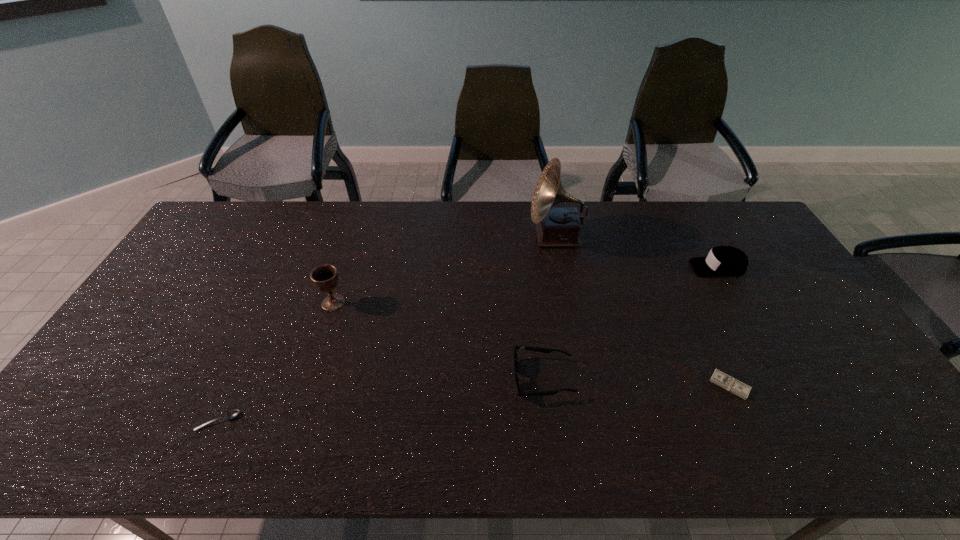
The height and width of the screenshot is (540, 960). Identify the location of the tallest object. (558, 227).

Locate an element on the screen. This screenshot has height=540, width=960. the fifth object from right to left is located at coordinates (325, 277).

The width and height of the screenshot is (960, 540). Identify the location of chalice. 325,277.

Identify the location of the third tallest object. This screenshot has height=540, width=960. (728, 261).

Image resolution: width=960 pixels, height=540 pixels. In order to click on the rightmost object in this screenshot , I will do `click(728, 261)`.

You are a GUI agent. You are given a task and a screenshot of the screen. Output one action in this format:
    pyautogui.click(x=<x>, y=<y>)
    Task: Click on the third shortest object
    The height and width of the screenshot is (540, 960).
    Given the screenshot: What is the action you would take?
    pyautogui.click(x=538, y=349)

Identify the location of money. The image size is (960, 540). pyautogui.click(x=723, y=380).

This screenshot has width=960, height=540. I want to click on the shortest object, so click(x=233, y=413).

Identify the location of the nearest object. Image resolution: width=960 pixels, height=540 pixels. (233, 413).

At what (x,y) coordinates should I click in order to perform the action: click on free space located on the horn of the tallest object. Please return your answer as a coordinate pair (x, y). This screenshot has height=540, width=960. Looking at the image, I should click on (500, 237).